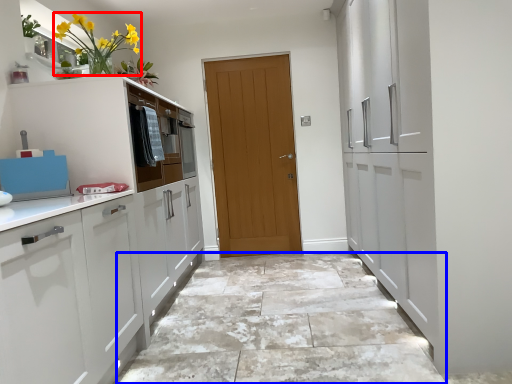
Question: Among these objects, which one is nearest to the camera, floral arrangement (highlighted by a red box) or granite (highlighted by a blue box)?

Choices:
 (A) floral arrangement
 (B) granite

Answer: (B)